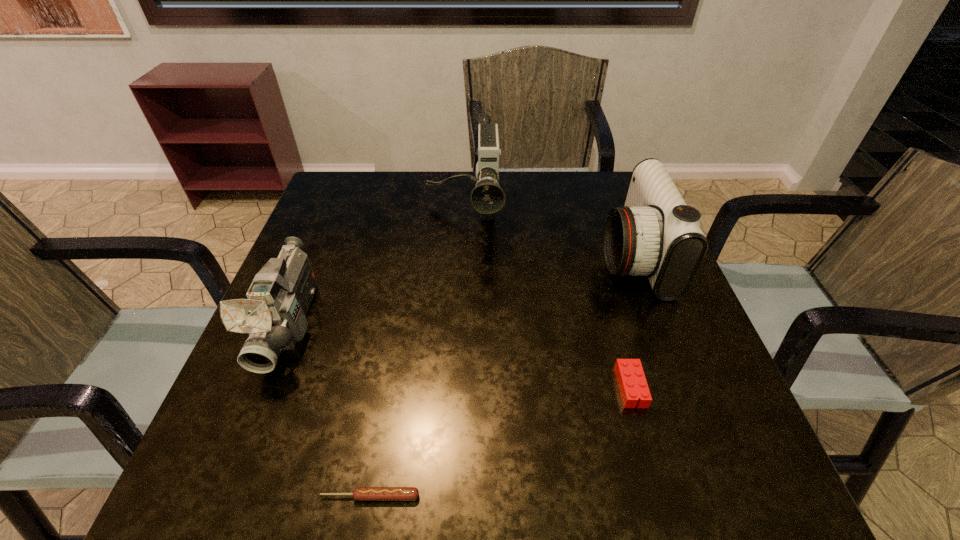
Locate an element on the screen. The width and height of the screenshot is (960, 540). vacant region that satisfies the following two spatial constraints: 1. on the surface of the rightmost camcorder; 2. on the front side of the second shortest object is located at coordinates (682, 387).